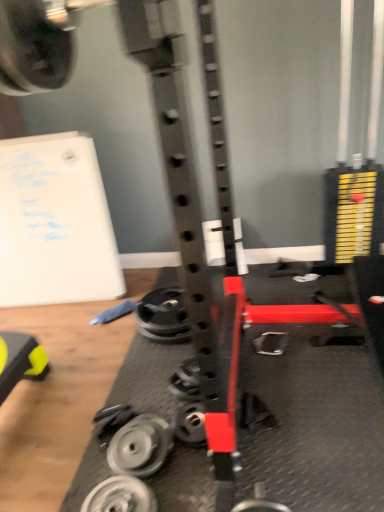
This screenshot has height=512, width=384. What are the coordinates of `free space on the front side of metallic silver weight at center, the fourth wheel in the bottom-to-top sequence` in the screenshot? It's located at (144, 367).